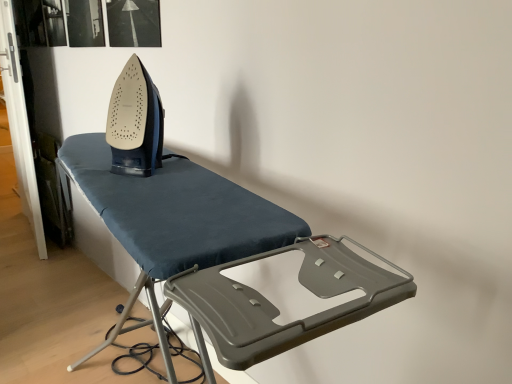
At what (x,y) coordinates should I click in order to perform the action: click on matte black iron at center. Please return your answer as a coordinate pair (x, y). The width and height of the screenshot is (512, 384). Looking at the image, I should click on pyautogui.click(x=135, y=123).

Image resolution: width=512 pixels, height=384 pixels. What do you see at coordinates (135, 123) in the screenshot?
I see `matte black iron at center` at bounding box center [135, 123].

Identify the location of dark blue fabric ironing board at center. This screenshot has height=384, width=512. (223, 252).

The width and height of the screenshot is (512, 384). What do you see at coordinates (223, 252) in the screenshot? I see `dark blue fabric ironing board at center` at bounding box center [223, 252].

At what (x,y) coordinates should I click in order to perform the action: click on matte black iron at center. Please return your answer as a coordinate pair (x, y). Looking at the image, I should click on (135, 123).

Does dark blue fabric ironing board at center appear on the left side of matte black iron at center?

No, dark blue fabric ironing board at center is not to the left of matte black iron at center.

Is the depth of dark blue fabric ironing board at center less than that of matte black iron at center?

Yes, it is.

Does point (242, 228) come behind point (143, 161)?

That is False.

From the image's perspective, would you say dark blue fabric ironing board at center is positioned over matte black iron at center?

No, from the image's perspective, dark blue fabric ironing board at center is not above matte black iron at center.

From a real-world perspective, is dark blue fabric ironing board at center on top of matte black iron at center?

Actually, dark blue fabric ironing board at center is physically below matte black iron at center in the real world.

Between dark blue fabric ironing board at center and matte black iron at center, which one has larger width?

Wider between the two is dark blue fabric ironing board at center.

Considering the sizes of objects dark blue fabric ironing board at center and matte black iron at center in the image provided, who is shorter, dark blue fabric ironing board at center or matte black iron at center?

matte black iron at center.

Between dark blue fabric ironing board at center and matte black iron at center, which one has larger size?

dark blue fabric ironing board at center is bigger.

Is matte black iron at center located within dark blue fabric ironing board at center?

Actually, matte black iron at center is outside dark blue fabric ironing board at center.

Is dark blue fabric ironing board at center positioned far away from matte black iron at center?

No, dark blue fabric ironing board at center is not far away from matte black iron at center.

Is dark blue fabric ironing board at center oriented towards matte black iron at center?

No, dark blue fabric ironing board at center is not facing towards matte black iron at center.

Measure the distance from dark blue fabric ironing board at center to matte black iron at center.

The distance of dark blue fabric ironing board at center from matte black iron at center is 8.68 inches.

Where is `equipment that is behind the dark blue fabric ironing board at center`? The width and height of the screenshot is (512, 384). equipment that is behind the dark blue fabric ironing board at center is located at coordinates (135, 123).

Between matte black iron at center and dark blue fabric ironing board at center, which one appears on the right side from the viewer's perspective?

Positioned to the right is dark blue fabric ironing board at center.

Considering their positions, is matte black iron at center located in front of or behind dark blue fabric ironing board at center?

Visually, matte black iron at center is located behind dark blue fabric ironing board at center.

Considering the points (130, 80) and (133, 238), which point is in front, point (130, 80) or point (133, 238)?

Point (133, 238)

From the image's perspective, which object appears higher, matte black iron at center or dark blue fabric ironing board at center?

From the image's view, matte black iron at center is above.

From a real-world perspective, is matte black iron at center physically above dark blue fabric ironing board at center?

Yes, from a real-world perspective, matte black iron at center is on top of dark blue fabric ironing board at center.

Does matte black iron at center have a greater width compared to dark blue fabric ironing board at center?

Incorrect, the width of matte black iron at center does not surpass that of dark blue fabric ironing board at center.

Considering the relative sizes of matte black iron at center and dark blue fabric ironing board at center in the image provided, is matte black iron at center taller than dark blue fabric ironing board at center?

Incorrect, the height of matte black iron at center is not larger of that of dark blue fabric ironing board at center.

Is matte black iron at center bigger than dark blue fabric ironing board at center?

Actually, matte black iron at center might be smaller than dark blue fabric ironing board at center.

In the scene shown: Is matte black iron at center located outside dark blue fabric ironing board at center?

Yes, matte black iron at center is located beyond the bounds of dark blue fabric ironing board at center.

Would you consider matte black iron at center to be distant from dark blue fabric ironing board at center?

Actually, matte black iron at center and dark blue fabric ironing board at center are a little close together.

Is matte black iron at center turned away from dark blue fabric ironing board at center?

No, dark blue fabric ironing board at center is not at the back of matte black iron at center.

What are the coordinates of `furniture in front of the matte black iron at center` in the screenshot? It's located at (223, 252).

Where is `furniture that appears in front of the matte black iron at center`? The height and width of the screenshot is (384, 512). furniture that appears in front of the matte black iron at center is located at coordinates (223, 252).

Identify the location of equipment to the left of dark blue fabric ironing board at center. This screenshot has width=512, height=384. (135, 123).